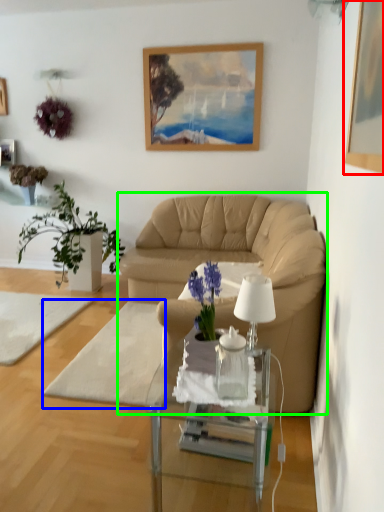
Question: Which object is the closest to the picture frame (highlighted by a red box)? Choose among these: footrest (highlighted by a blue box) or studio couch (highlighted by a green box).

Choices:
 (A) footrest
 (B) studio couch

Answer: (B)